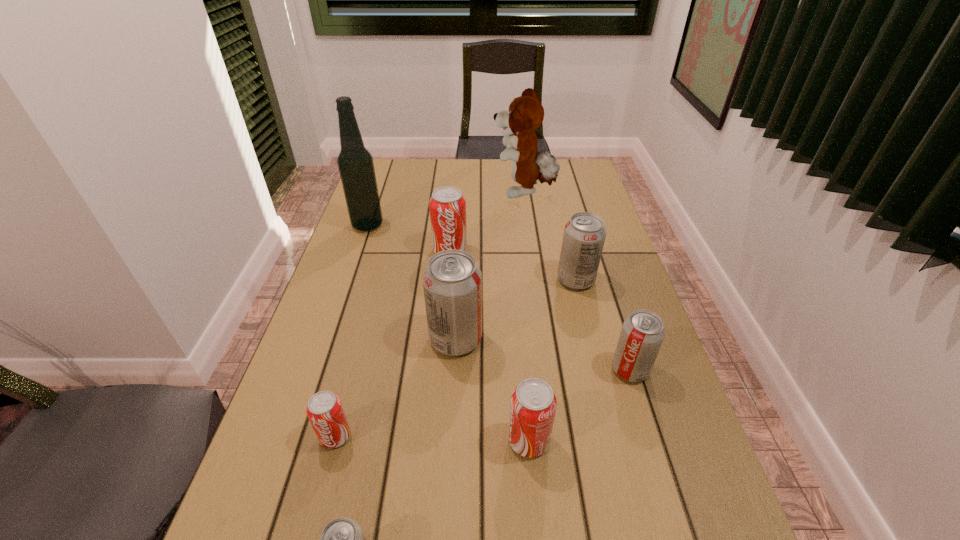
Locate an element on the screen. puppy at the right edge is located at coordinates (525, 114).

The width and height of the screenshot is (960, 540). What are the coordinates of `object that is at the far right corner` in the screenshot? It's located at (525, 114).

In the image, there is a desktop. At what (x,y) coordinates should I click in order to perform the action: click on free space at the far edge. Please return your answer as a coordinate pair (x, y). This screenshot has height=540, width=960. Looking at the image, I should click on (504, 174).

Locate an element on the screen. vacant space at the left edge is located at coordinates (248, 507).

Where is `free spot at the right edge of the desktop`? The image size is (960, 540). free spot at the right edge of the desktop is located at coordinates (603, 280).

In the image, there is a desktop. Identify the location of vacant space at the far right corner. The width and height of the screenshot is (960, 540). (595, 188).

Identify the location of free spot between the third biggest gray soda can and the third farthest object. (540, 310).

This screenshot has height=540, width=960. I want to click on unoccupied area between the sixth nearest object and the farthest red soda can, so click(513, 265).

Identify the location of free space between the farthest soda can and the second smallest gray soda can. (540, 310).

At what (x,y) coordinates should I click in order to perform the action: click on vacant area between the leftmost red soda can and the third smallest gray soda can. Please return your answer as a coordinate pair (x, y). Image resolution: width=960 pixels, height=540 pixels. Looking at the image, I should click on (456, 358).